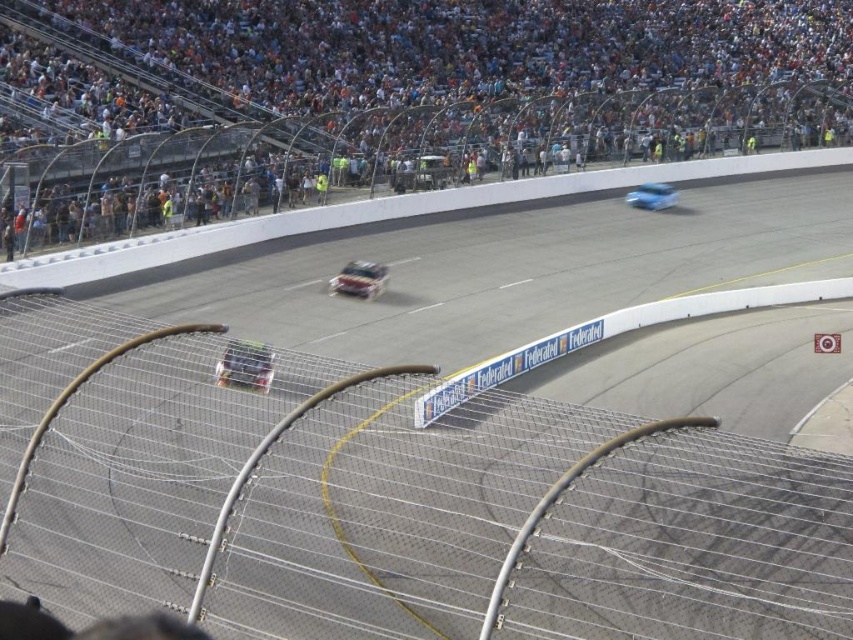
Does shiny metallic car at center appear on the left side of shiny blue car at center?

Correct, you'll find shiny metallic car at center to the left of shiny blue car at center.

Is shiny metallic car at center shorter than shiny blue car at center?

No.

What do you see at coordinates (358, 280) in the screenshot? The image size is (853, 640). I see `shiny metallic car at center` at bounding box center [358, 280].

Locate an element on the screen. The height and width of the screenshot is (640, 853). shiny metallic car at center is located at coordinates (358, 280).

Is shiny silver race car at center taller than shiny blue car at center?

Incorrect, shiny silver race car at center's height is not larger of shiny blue car at center's.

Between shiny silver race car at center and shiny blue car at center, which one has less height?

shiny silver race car at center

What do you see at coordinates (245, 365) in the screenshot?
I see `shiny silver race car at center` at bounding box center [245, 365].

You are a GUI agent. You are given a task and a screenshot of the screen. Output one action in this format:
    pyautogui.click(x=<x>, y=<y>)
    Task: Click on the shiny silver race car at center
    This screenshot has height=640, width=853.
    Given the screenshot: What is the action you would take?
    pyautogui.click(x=245, y=365)

Who is more forward, [490,145] or [625,195]?

Point [490,145] is more forward.

Can you confirm if white plastic crowd at upper left is wider than shiny blue car at center?

Yes, white plastic crowd at upper left is wider than shiny blue car at center.

Locate an element on the screen. Image resolution: width=853 pixels, height=640 pixels. white plastic crowd at upper left is located at coordinates (386, 97).

Locate an element on the screen. The width and height of the screenshot is (853, 640). white plastic crowd at upper left is located at coordinates (386, 97).